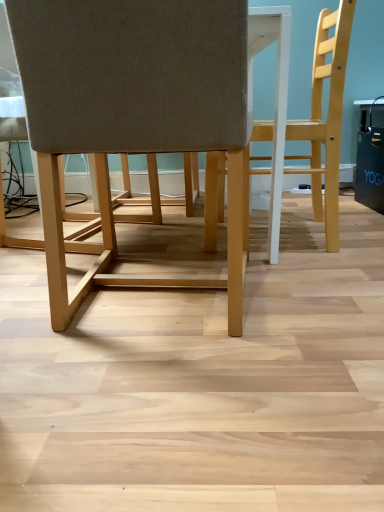
Describe the element at coordinates (132, 109) in the screenshot. I see `light brown fabric chair at center, which is the 1th chair in left-to-right order` at that location.

Find the location of a particular element. light brown fabric chair at center, which is the 1th chair in left-to-right order is located at coordinates (132, 109).

This screenshot has width=384, height=512. Describe the element at coordinates (327, 116) in the screenshot. I see `light wood chair at right, the 1th chair positioned from the right` at that location.

This screenshot has height=512, width=384. In order to click on light wood chair at right, which is the second chair from left to right in this screenshot , I will do `click(327, 116)`.

Measure the distance between light wood chair at right, the 1th chair positioned from the right, and camera.

light wood chair at right, the 1th chair positioned from the right, is 1.33 meters from camera.

This screenshot has height=512, width=384. Find the location of `light brown fabric chair at center, which is the 1th chair in left-to-right order`. light brown fabric chair at center, which is the 1th chair in left-to-right order is located at coordinates (132, 109).

Considering the positions of objects light brown fabric chair at center, which is the 1th chair in left-to-right order, and light wood chair at right, the 1th chair positioned from the right, in the image provided, who is more to the right, light brown fabric chair at center, which is the 1th chair in left-to-right order, or light wood chair at right, the 1th chair positioned from the right,?

light wood chair at right, the 1th chair positioned from the right, is more to the right.

Consider the image. In the image, is light brown fabric chair at center, placed as the 2th chair when sorted from right to left, positioned in front of or behind light wood chair at right, the 1th chair positioned from the right?

Visually, light brown fabric chair at center, placed as the 2th chair when sorted from right to left, is located in front of light wood chair at right, the 1th chair positioned from the right.

Does point (127, 120) come in front of point (320, 139)?

Yes.

Based on the photo, from the image's perspective, which one is positioned higher, light brown fabric chair at center, placed as the 2th chair when sorted from right to left, or light wood chair at right, the 1th chair positioned from the right?

light wood chair at right, the 1th chair positioned from the right, is shown above in the image.

From a real-world perspective, is light brown fabric chair at center, placed as the 2th chair when sorted from right to left, below light wood chair at right, which is the second chair from left to right?

Correct, in the physical world, light brown fabric chair at center, placed as the 2th chair when sorted from right to left, is lower than light wood chair at right, which is the second chair from left to right.

Considering the sizes of objects light brown fabric chair at center, which is the 1th chair in left-to-right order, and light wood chair at right, which is the second chair from left to right, in the image provided, who is wider, light brown fabric chair at center, which is the 1th chair in left-to-right order, or light wood chair at right, which is the second chair from left to right,?

With larger width is light brown fabric chair at center, which is the 1th chair in left-to-right order.

Considering the sizes of objects light brown fabric chair at center, placed as the 2th chair when sorted from right to left, and light wood chair at right, which is the second chair from left to right, in the image provided, who is shorter, light brown fabric chair at center, placed as the 2th chair when sorted from right to left, or light wood chair at right, which is the second chair from left to right,?

With less height is light brown fabric chair at center, placed as the 2th chair when sorted from right to left.

Looking at this image, who is bigger, light brown fabric chair at center, placed as the 2th chair when sorted from right to left, or light wood chair at right, which is the second chair from left to right?

With larger size is light brown fabric chair at center, placed as the 2th chair when sorted from right to left.

Is light brown fabric chair at center, placed as the 2th chair when sorted from right to left, outside of light wood chair at right, which is the second chair from left to right?

light brown fabric chair at center, placed as the 2th chair when sorted from right to left, lies outside light wood chair at right, which is the second chair from left to right,'s area.

Is light brown fabric chair at center, which is the 1th chair in left-to-right order, placed right next to light wood chair at right, the 1th chair positioned from the right?

No, light brown fabric chair at center, which is the 1th chair in left-to-right order, is not with light wood chair at right, the 1th chair positioned from the right.

Consider the image. Is light brown fabric chair at center, which is the 1th chair in left-to-right order, turned away from light wood chair at right, which is the second chair from left to right?

No, light brown fabric chair at center, which is the 1th chair in left-to-right order, is not facing away from light wood chair at right, which is the second chair from left to right.

What's the angular difference between light brown fabric chair at center, placed as the 2th chair when sorted from right to left, and light wood chair at right, the 1th chair positioned from the right,'s facing directions?

The facing directions of light brown fabric chair at center, placed as the 2th chair when sorted from right to left, and light wood chair at right, the 1th chair positioned from the right, are 88.8 degrees apart.

Identify the location of chair that appears behind the light brown fabric chair at center, placed as the 2th chair when sorted from right to left. (327, 116).

Visually, is light wood chair at right, which is the second chair from left to right, positioned to the left or to the right of light brown fabric chair at center, which is the 1th chair in left-to-right order?

light wood chair at right, which is the second chair from left to right, is to the right of light brown fabric chair at center, which is the 1th chair in left-to-right order.

Is light wood chair at right, which is the second chair from left to right, closer to the viewer compared to light brown fabric chair at center, placed as the 2th chair when sorted from right to left?

No, it is not.

Does point (326, 202) come behind point (99, 53)?

Yes.

From the image's perspective, does light wood chair at right, which is the second chair from left to right, appear higher than light brown fabric chair at center, which is the 1th chair in left-to-right order?

Correct, light wood chair at right, which is the second chair from left to right, appears higher than light brown fabric chair at center, which is the 1th chair in left-to-right order, in the image.

From a real-world perspective, is light wood chair at right, which is the second chair from left to right, physically located above or below light brown fabric chair at center, placed as the 2th chair when sorted from right to left?

From a real-world perspective, light wood chair at right, which is the second chair from left to right, is physically above light brown fabric chair at center, placed as the 2th chair when sorted from right to left.

Considering the relative sizes of light wood chair at right, the 1th chair positioned from the right, and light brown fabric chair at center, placed as the 2th chair when sorted from right to left, in the image provided, is light wood chair at right, the 1th chair positioned from the right, wider than light brown fabric chair at center, placed as the 2th chair when sorted from right to left,?

No.

Is light wood chair at right, which is the second chair from left to right, taller than light brown fabric chair at center, which is the 1th chair in left-to-right order?

Correct, light wood chair at right, which is the second chair from left to right, is much taller as light brown fabric chair at center, which is the 1th chair in left-to-right order.

In terms of size, does light wood chair at right, which is the second chair from left to right, appear bigger or smaller than light brown fabric chair at center, placed as the 2th chair when sorted from right to left?

In the image, light wood chair at right, which is the second chair from left to right, appears to be smaller than light brown fabric chair at center, placed as the 2th chair when sorted from right to left.

Choose the correct answer: Is light wood chair at right, the 1th chair positioned from the right, inside light brown fabric chair at center, which is the 1th chair in left-to-right order, or outside it?

light wood chair at right, the 1th chair positioned from the right, is outside light brown fabric chair at center, which is the 1th chair in left-to-right order.

Is light wood chair at right, which is the second chair from left to right, positioned far away from light brown fabric chair at center, placed as the 2th chair when sorted from right to left?

No, there isn't a large distance between light wood chair at right, which is the second chair from left to right, and light brown fabric chair at center, placed as the 2th chair when sorted from right to left.

Is light wood chair at right, which is the second chair from left to right, facing towards light brown fabric chair at center, which is the 1th chair in left-to-right order?

No.

Measure the distance from light wood chair at right, the 1th chair positioned from the right, to light brown fabric chair at center, placed as the 2th chair when sorted from right to left.

They are 26.19 inches apart.

Identify the location of chair below the light wood chair at right, the 1th chair positioned from the right (from the image's perspective). This screenshot has height=512, width=384. (132, 109).

Identify the location of chair to the right of light brown fabric chair at center, placed as the 2th chair when sorted from right to left. (327, 116).

Locate an element on the screen. chair that is on the left side of light wood chair at right, which is the second chair from left to right is located at coordinates (132, 109).